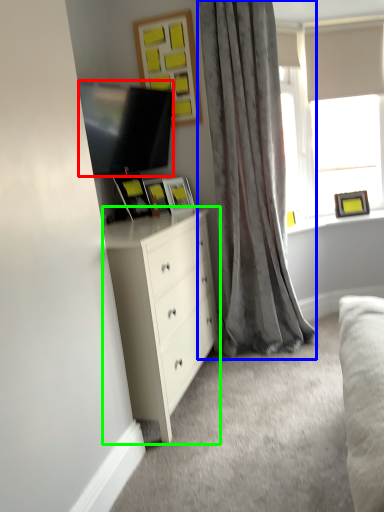
Question: Considering the real-world distances, which object is closest to television (highlighted by a red box)? curtain (highlighted by a blue box) or chest of drawers (highlighted by a green box).

Choices:
 (A) curtain
 (B) chest of drawers

Answer: (A)